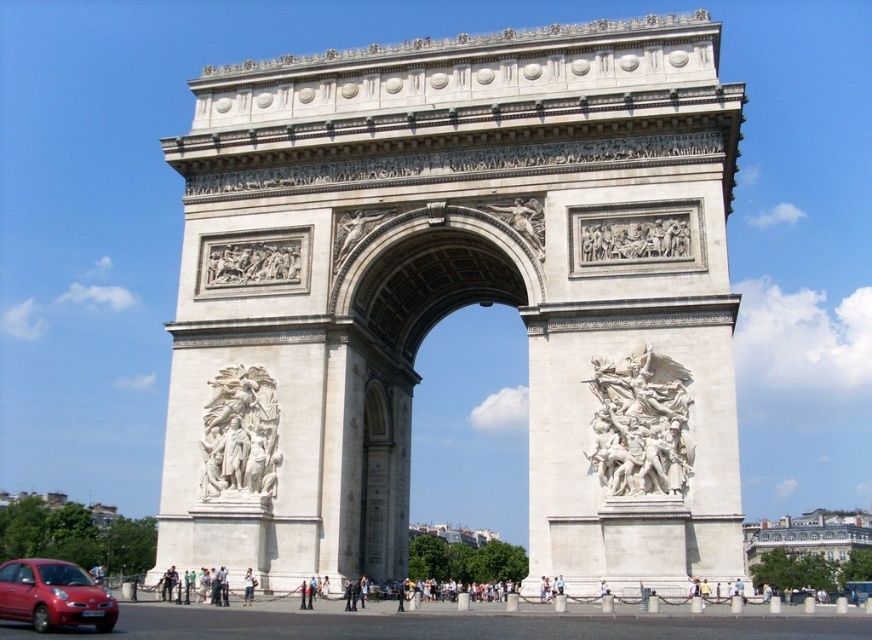
You are standing in front of the Arc de Triomphe and notice a light brown leather jacket at center and a white marble sculpture at center. Which object is closer to you?

The white marble sculpture at center is closer to you because the light brown leather jacket at center is behind it.

You are a tourist standing in front of the Arc de Triomphe and see the white marble sculpture at center and the light brown leather jacket at center. Which object is wider?

The white marble sculpture at center is wider than the light brown leather jacket at center according to the description.